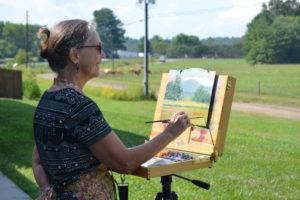
Locate an element on the screen. The height and width of the screenshot is (200, 300). painting is located at coordinates (274, 73), (189, 87).